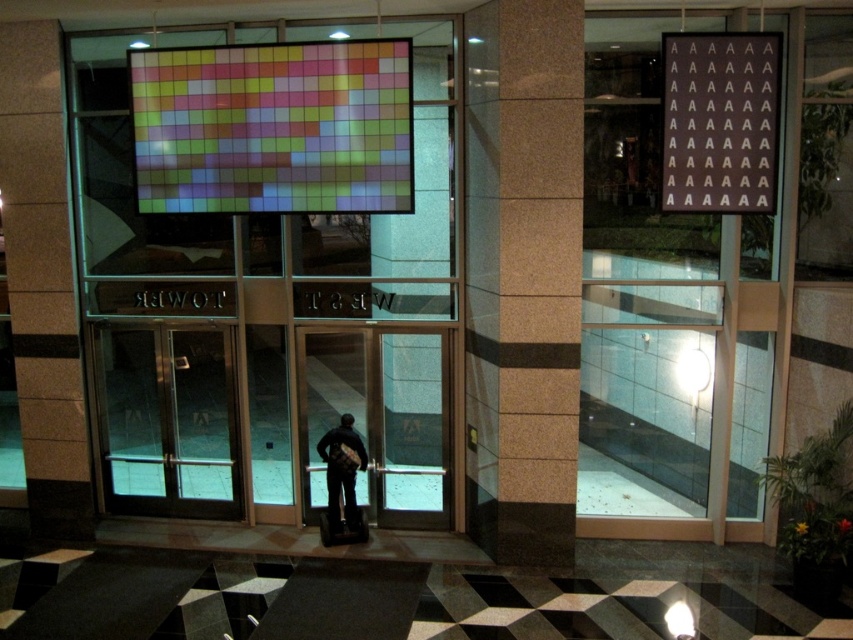
You are a delivery person holding a large package that is 1.2 meters wide. You need to enter the building through the entrance shown in the image. Can you fit through the transparent glass door at center while carrying the package? Consider the dark gray fabric jacket at center that is also present in the scene.

The transparent glass door at center is wider than the dark gray fabric jacket at center. Since the jacket is at center, the door must be wider than 1.2 meters. Therefore, the package can fit through the door.

You are standing at the entrance of the modern building at night. You see a point marked at coordinates (281, 314). According to the image, where is this point located?

The point at (281, 314) is located on the translucent glass elevator at center.

You are a delivery person trying to enter the building through the entrance. You see the transparent glass door at center and the dark gray fabric jacket at center. Which object is closer to the ground?

The dark gray fabric jacket at center is closer to the ground because the transparent glass door at center is above it.